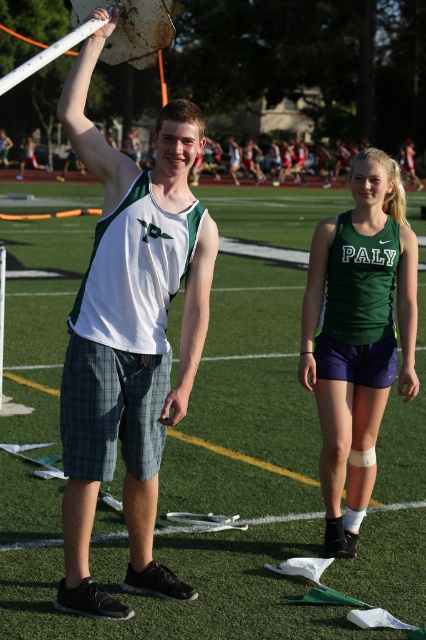
Does green fabric field at center have a lesser width compared to green matte tank top at center?

Incorrect, green fabric field at center's width is not less than green matte tank top at center's.

Is green fabric field at center above green matte tank top at center?

Yes.

Is point (169, 460) closer to camera compared to point (322, 289)?

No, it is not.

This screenshot has width=426, height=640. Identify the location of green fabric field at center. (201, 492).

Which of these two, green fabric field at center or matte white tank top at center, stands taller?

green fabric field at center

Can you confirm if green fabric field at center is thinner than matte white tank top at center?

No.

At what (x,y) coordinates should I click in order to perform the action: click on green fabric field at center. Please return your answer as a coordinate pair (x, y). Image resolution: width=426 pixels, height=640 pixels. Looking at the image, I should click on (201, 492).

Between matte white tank top at center and green matte tank top at center, which one appears on the right side from the viewer's perspective?

From the viewer's perspective, green matte tank top at center appears more on the right side.

Who is more forward, (x=103, y=385) or (x=359, y=497)?

Positioned in front is point (x=103, y=385).

In order to click on matte white tank top at center in this screenshot , I will do `click(129, 337)`.